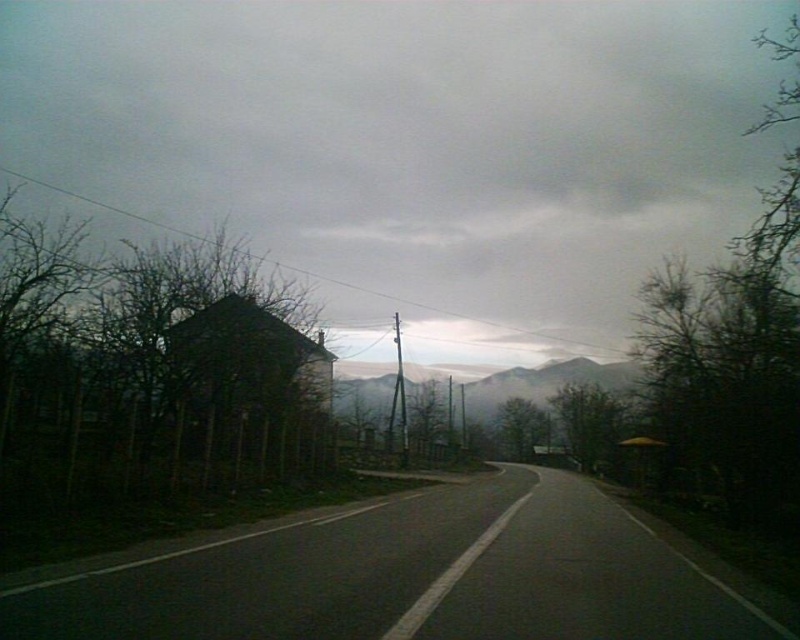
Who is positioned more to the left, black asphalt road at center or foggy misty mountains at center?

Positioned to the left is black asphalt road at center.

From the picture: Who is more distant from viewer, (134,563) or (628,388)?

The point (628,388) is more distant.

Who is more distant from viewer, (362, 564) or (468, 394)?

The point (468, 394) is behind.

Where is `black asphalt road at center`? This screenshot has width=800, height=640. black asphalt road at center is located at coordinates coord(401,576).

Can you confirm if dark brown wooden hut at center is positioned above foggy misty mountains at center?

Yes.

Between dark brown wooden hut at center and foggy misty mountains at center, which one appears on the right side from the viewer's perspective?

Positioned to the right is foggy misty mountains at center.

What are the coordinates of `dark brown wooden hut at center` in the screenshot? It's located at (252, 390).

In the scene shown: Does black asphalt road at center appear over dark brown wooden hut at center?

Actually, black asphalt road at center is below dark brown wooden hut at center.

Between point (385, 560) and point (193, 410), which one is positioned in front?

Point (385, 560) is in front.

The image size is (800, 640). I want to click on black asphalt road at center, so click(x=401, y=576).